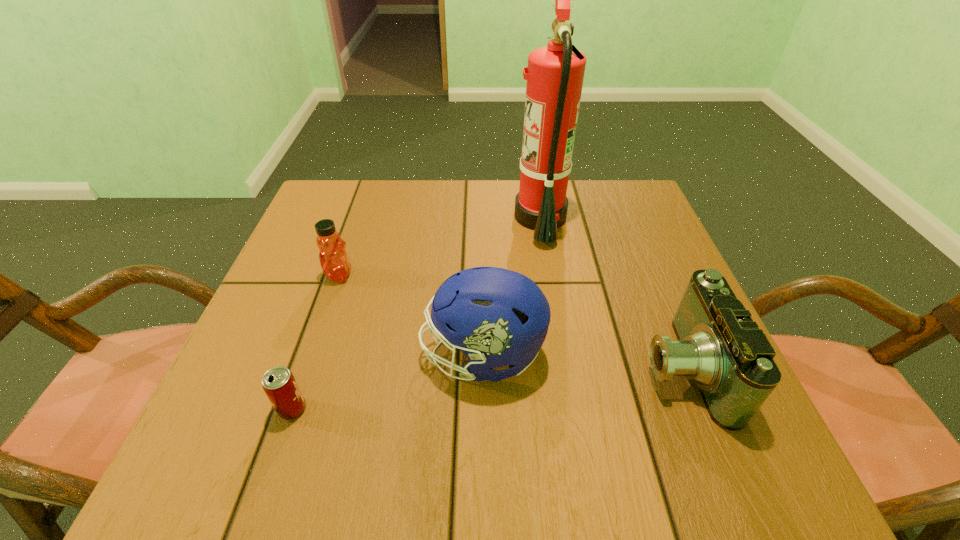
Where is `beer can at the left edge`? beer can at the left edge is located at coordinates (279, 384).

I want to click on object that is at the right edge, so click(719, 347).

Locate an element on the screen. Image resolution: width=960 pixels, height=540 pixels. object that is at the near right corner is located at coordinates (719, 347).

The height and width of the screenshot is (540, 960). In the image, there is a desktop. What are the coordinates of `free region at the far edge` in the screenshot? It's located at (428, 200).

You are a GUI agent. You are given a task and a screenshot of the screen. Output one action in this format:
    pyautogui.click(x=<x>, y=<y>)
    Task: Click on the vacant space at the near edge
    Image resolution: width=960 pixels, height=540 pixels.
    Given the screenshot: What is the action you would take?
    pyautogui.click(x=444, y=447)

At what (x,y) coordinates should I click in order to perform the action: click on vacant region at the left edge of the desktop. Please return your answer as a coordinate pair (x, y). Looking at the image, I should click on (359, 246).

Where is `vacant space at the right edge`? The height and width of the screenshot is (540, 960). vacant space at the right edge is located at coordinates pos(624,301).

Locate an element on the screen. The width and height of the screenshot is (960, 540). blank space at the far left corner of the desktop is located at coordinates (374, 188).

Identify the location of vacant space at the near left corner of the desktop. (203, 430).

Find the location of a particular element. This screenshot has height=540, width=960. free space at the far right corner of the desktop is located at coordinates (593, 230).